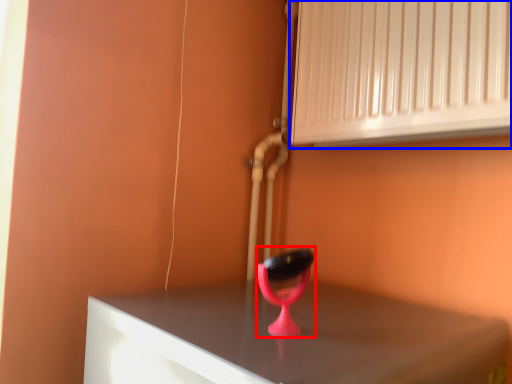
Question: Among these objects, which one is farthest to the camera, table lamp (highlighted by a red box) or air conditioning (highlighted by a blue box)?

Choices:
 (A) table lamp
 (B) air conditioning

Answer: (B)